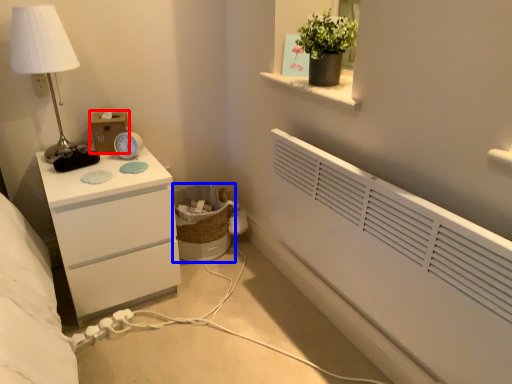
Question: Which of the following is the farthest to the observer, box (highlighted by a red box) or laundry basket (highlighted by a blue box)?

Choices:
 (A) box
 (B) laundry basket

Answer: (B)